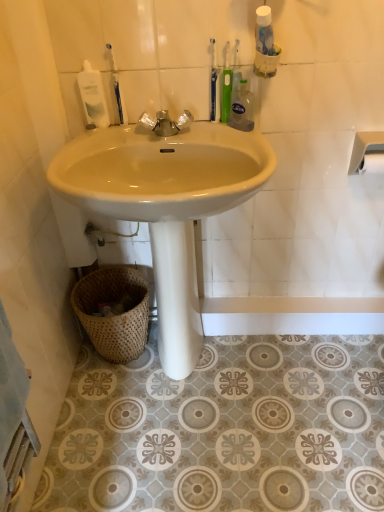
Question: Is matte ceramic sink at center looking in the opposite direction of matte silver faucet at center?

Choices:
 (A) no
 (B) yes

Answer: (A)

Question: From the image's perspective, is matte ceramic sink at center located above matte silver faucet at center?

Choices:
 (A) yes
 (B) no

Answer: (B)

Question: From a real-world perspective, is matte ceramic sink at center physically below matte silver faucet at center?

Choices:
 (A) yes
 (B) no

Answer: (A)

Question: Is matte ceramic sink at center not near matte silver faucet at center?

Choices:
 (A) yes
 (B) no

Answer: (B)

Question: Is matte ceramic sink at center at the right side of matte silver faucet at center?

Choices:
 (A) no
 (B) yes

Answer: (B)

Question: From a real-world perspective, is matte ceramic sink at center located higher than matte silver faucet at center?

Choices:
 (A) no
 (B) yes

Answer: (A)

Question: Is clear liquid soap at upper center to the right of blue plastic toothbrush at upper left, marked as the first toothbrush in a left-to-right arrangement, from the viewer's perspective?

Choices:
 (A) yes
 (B) no

Answer: (A)

Question: From a real-world perspective, is clear liquid soap at upper center positioned under blue plastic toothbrush at upper left, which ranks as the fourth toothbrush in right-to-left order, based on gravity?

Choices:
 (A) no
 (B) yes

Answer: (B)

Question: From the image's perspective, would you say clear liquid soap at upper center is positioned over blue plastic toothbrush at upper left, marked as the first toothbrush in a left-to-right arrangement?

Choices:
 (A) yes
 (B) no

Answer: (B)

Question: From the image's perspective, does clear liquid soap at upper center appear lower than blue plastic toothbrush at upper left, which ranks as the fourth toothbrush in right-to-left order?

Choices:
 (A) no
 (B) yes

Answer: (B)

Question: Considering the relative sizes of clear liquid soap at upper center and blue plastic toothbrush at upper left, which ranks as the fourth toothbrush in right-to-left order, in the image provided, is clear liquid soap at upper center smaller than blue plastic toothbrush at upper left, which ranks as the fourth toothbrush in right-to-left order,?

Choices:
 (A) no
 (B) yes

Answer: (A)

Question: Is clear liquid soap at upper center oriented away from blue plastic toothbrush at upper left, which ranks as the fourth toothbrush in right-to-left order?

Choices:
 (A) yes
 (B) no

Answer: (B)

Question: Does white glossy mouthwash at upper left appear on the left side of matte ceramic sink at center?

Choices:
 (A) yes
 (B) no

Answer: (A)